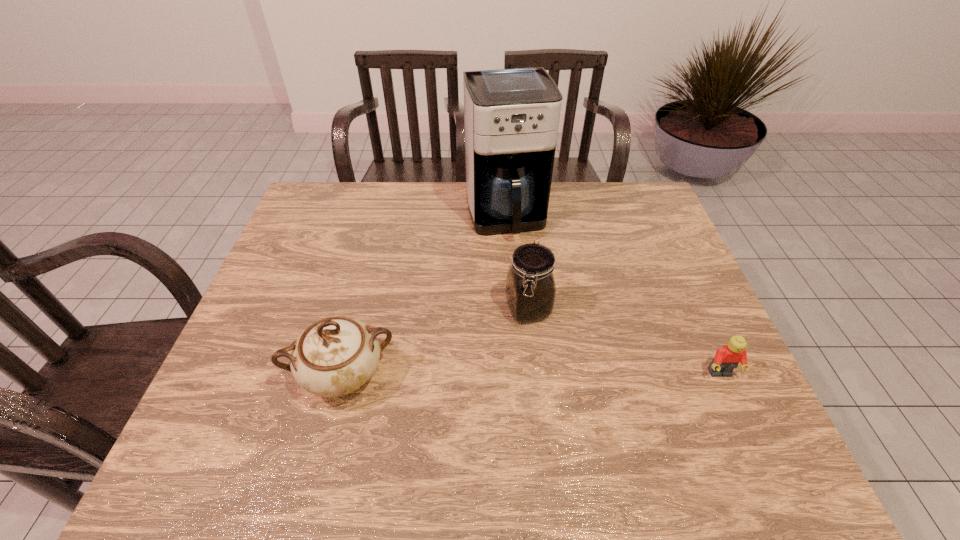
This screenshot has width=960, height=540. I want to click on vacant space on the desktop that is between the leftmost object and the shortest object and is positioned on the front panel of the tallest object, so click(x=555, y=375).

Identify the location of vacant spot on the desktop that is between the chinaware and the shortest object and is positioned on the lid of the third nearest object. (555, 375).